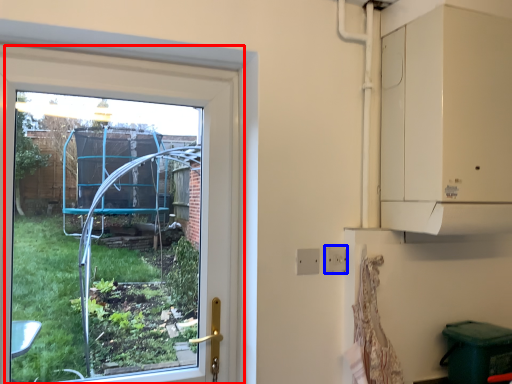
Question: Among these objects, which one is nearest to the camera, window (highlighted by a red box) or electric outlet (highlighted by a blue box)?

Choices:
 (A) window
 (B) electric outlet

Answer: (A)